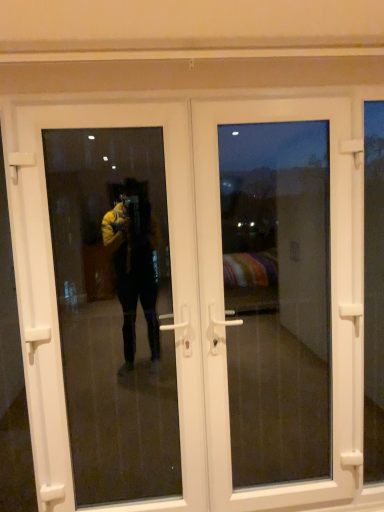
Question: Which direction should I rotate to look at white plastic door at center, which ranks as the 1th door in right-to-left order?

Choices:
 (A) right
 (B) left

Answer: (A)

Question: Does white plastic door at center, positioned as the first door in left-to-right order, have a larger size compared to transparent glass door at left?

Choices:
 (A) yes
 (B) no

Answer: (A)

Question: From the image's perspective, would you say white plastic door at center, positioned as the first door in left-to-right order, is positioned over transparent glass door at left?

Choices:
 (A) yes
 (B) no

Answer: (B)

Question: Is white plastic door at center, positioned as the 2th door in right-to-left order, positioned with its back to transparent glass door at left?

Choices:
 (A) yes
 (B) no

Answer: (A)

Question: Is white plastic door at center, positioned as the 2th door in right-to-left order, taller than transparent glass door at left?

Choices:
 (A) no
 (B) yes

Answer: (A)

Question: Is transparent glass door at left completely or partially inside white plastic door at center, positioned as the 2th door in right-to-left order?

Choices:
 (A) yes
 (B) no

Answer: (A)

Question: Considering the relative sizes of white plastic door at center, positioned as the 2th door in right-to-left order, and transparent glass door at left in the image provided, is white plastic door at center, positioned as the 2th door in right-to-left order, smaller than transparent glass door at left?

Choices:
 (A) no
 (B) yes

Answer: (A)

Question: From the image's perspective, would you say white plastic door at center, positioned as the 2th door in right-to-left order, is shown under white plastic door at center, which ranks as the 1th door in right-to-left order?

Choices:
 (A) yes
 (B) no

Answer: (A)

Question: Considering the relative positions of white plastic door at center, positioned as the first door in left-to-right order, and white plastic door at center, which ranks as the second door in left-to-right order, in the image provided, is white plastic door at center, positioned as the first door in left-to-right order, to the left of white plastic door at center, which ranks as the second door in left-to-right order, from the viewer's perspective?

Choices:
 (A) no
 (B) yes

Answer: (B)

Question: Would you say white plastic door at center, positioned as the 2th door in right-to-left order, is outside white plastic door at center, which ranks as the second door in left-to-right order?

Choices:
 (A) yes
 (B) no

Answer: (B)

Question: Is white plastic door at center, positioned as the 2th door in right-to-left order, placed right next to white plastic door at center, which ranks as the second door in left-to-right order?

Choices:
 (A) yes
 (B) no

Answer: (B)

Question: From a real-world perspective, is white plastic door at center, positioned as the 2th door in right-to-left order, on white plastic door at center, which ranks as the second door in left-to-right order?

Choices:
 (A) no
 (B) yes

Answer: (A)

Question: Does white plastic door at center, positioned as the 2th door in right-to-left order, have a lesser width compared to white plastic door at center, which ranks as the second door in left-to-right order?

Choices:
 (A) yes
 (B) no

Answer: (A)

Question: Does white plastic door at center, which ranks as the 1th door in right-to-left order, have a greater width compared to transparent glass door at left?

Choices:
 (A) no
 (B) yes

Answer: (B)